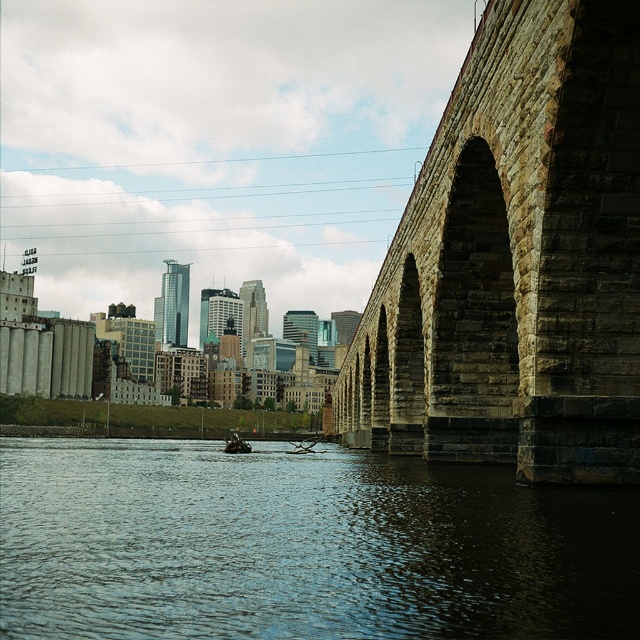
You are a tourist standing on the left side of the dark blue water at center and want to take a photo of the stone arch bridge at right. Can you see the entire bridge in your camera frame without moving your position?

The dark blue water at center has a lesser height compared to stone arch bridge at right, so yes, the tourist can see the entire bridge in their camera frame because the bridge is taller and extends above the water level.

You are an architect designing a miniature model of this urban landscape. You need to ensure that the dark blue water at center and the green plastic boat at center are scaled correctly. Which object should be smaller in the model to maintain the correct proportions?

The dark blue water at center should be smaller in the model because it occupies less space than the green plastic boat at center in the original scene.